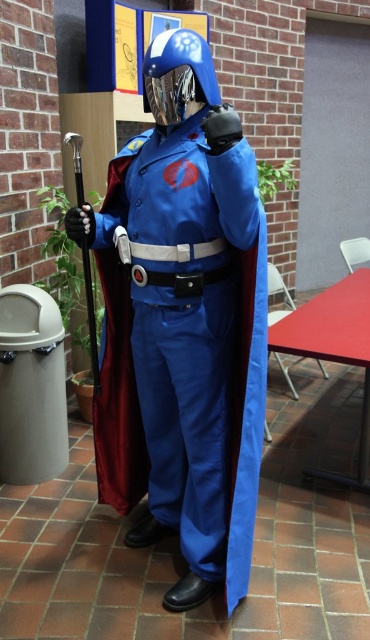
Can you confirm if matte blue suit at center is bigger than blue metallic helmet at center?

Indeed, matte blue suit at center has a larger size compared to blue metallic helmet at center.

Does matte blue suit at center appear on the right side of blue metallic helmet at center?

In fact, matte blue suit at center is to the left of blue metallic helmet at center.

Which is in front, point (185, 588) or point (170, 72)?

Point (170, 72) is in front.

You are a GUI agent. You are given a task and a screenshot of the screen. Output one action in this format:
    pyautogui.click(x=<x>, y=<y>)
    Task: Click on the matte blue suit at center
    This screenshot has width=370, height=640.
    Given the screenshot: What is the action you would take?
    pyautogui.click(x=183, y=323)